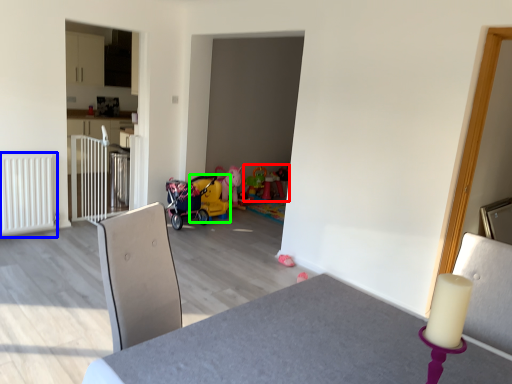
Question: Estimate the real-world distances between objects in this image. Which object is closer to toy (highlighted by a red box), radiator (highlighted by a blue box) or baby carriage (highlighted by a green box)?

Choices:
 (A) radiator
 (B) baby carriage

Answer: (B)